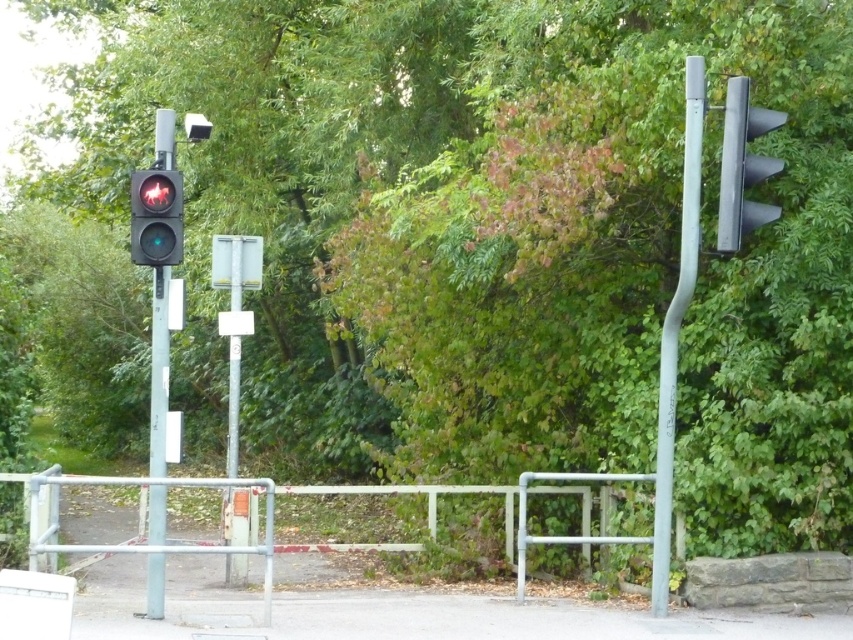
Does point (248, 324) come farther from viewer compared to point (238, 253)?

That is False.

I want to click on metallic gray sign at center, so click(x=235, y=316).

Is point (229, 392) positioned in front of point (231, 384)?

No.

Where is `metallic gray sign at center`? This screenshot has width=853, height=640. metallic gray sign at center is located at coordinates (x=235, y=316).

How far apart are metallic gray sign at center and metallic rectangular sign at center?

A distance of 1.08 meters exists between metallic gray sign at center and metallic rectangular sign at center.

In the scene shown: Which is more to the right, metallic gray sign at center or metallic rectangular sign at center?

metallic gray sign at center

Which is in front, point (235, 442) or point (241, 275)?

Positioned in front is point (235, 442).

Where is `metallic gray sign at center`? metallic gray sign at center is located at coordinates (235, 316).

Can you confirm if metallic pole at left is bigger than matte glass traffic light at left?

Actually, metallic pole at left might be smaller than matte glass traffic light at left.

Between point (160, 577) and point (148, 224), which one is positioned in front?

Point (148, 224) is in front.

Is point (158, 324) positioned in front of point (142, 244)?

No, (158, 324) is further to viewer.

Find the location of a particular element. metallic pole at left is located at coordinates (160, 371).